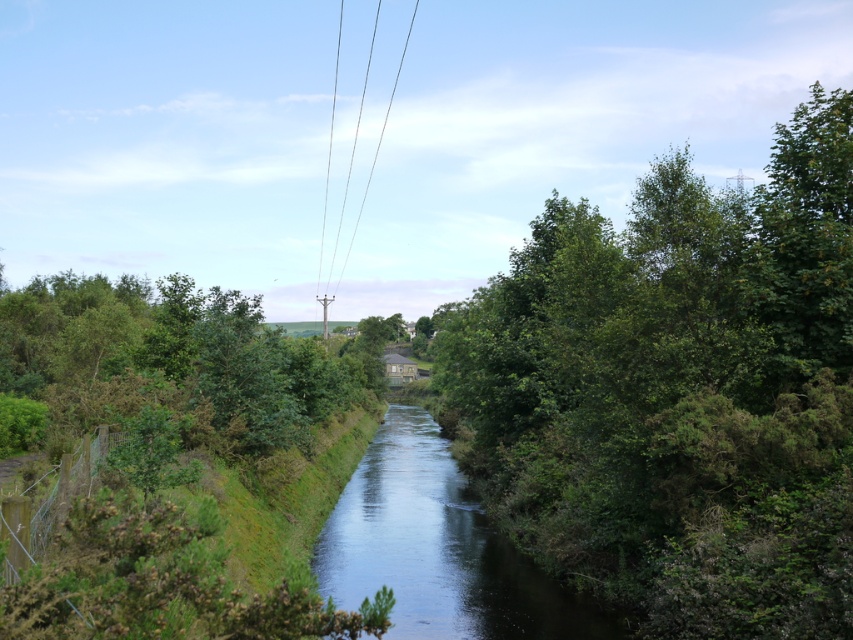
Does green leafy tree at center right have a lesser width compared to metallic wire at center?

No, green leafy tree at center right is not thinner than metallic wire at center.

Between point (553, 220) and point (415, 13), which one is positioned behind?

Point (415, 13)

Does point (775, 145) come behind point (347, 250)?

Yes, it is.

Identify the location of green leafy tree at center right. (676, 392).

Does clear water at center appear under metallic wire at center?

Correct, clear water at center is located below metallic wire at center.

Is point (392, 493) in front of point (387, 112)?

Yes, point (392, 493) is closer to viewer.

Image resolution: width=853 pixels, height=640 pixels. Find the location of `clear water at center`. clear water at center is located at coordinates (437, 548).

Can you confirm if green leafy tree at left is shorter than metallic wire at center?

Yes, green leafy tree at left is shorter than metallic wire at center.

Is point (248, 349) positioned behind point (370, 173)?

That is False.

This screenshot has height=640, width=853. Identify the location of green leafy tree at left. (173, 362).